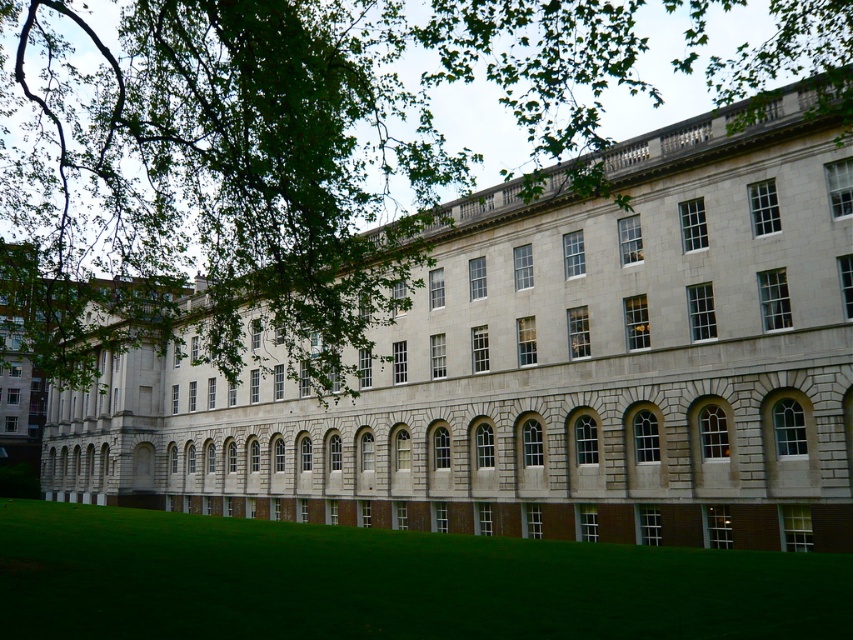
You are standing in front of the gray stone building at center and looking down at the green grass at lower center. Which object is taller?

The gray stone building at center is taller than the green grass at lower center.

You are standing in front of a grand classical building. You notice the gray stone building at center and the green grass at lower center. Which object takes up more space in the image?

The gray stone building at center is larger in size than the green grass at lower center, so it takes up more space in the image.

You are standing in a park and see the gray stone building at center and the green grass at lower center. Which object is closer to you?

The gray stone building at center is closer to you because the green grass at lower center is behind it.